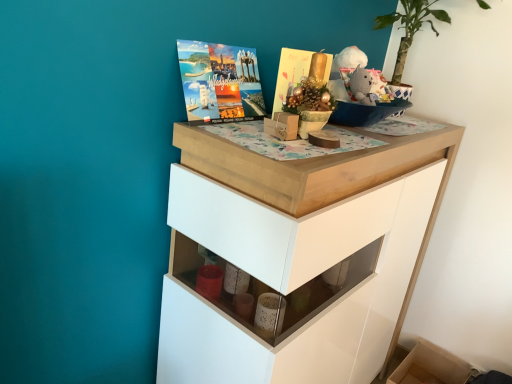
Where is `unoccupied region to the right of matte brown box at center`? unoccupied region to the right of matte brown box at center is located at coordinates (357, 146).